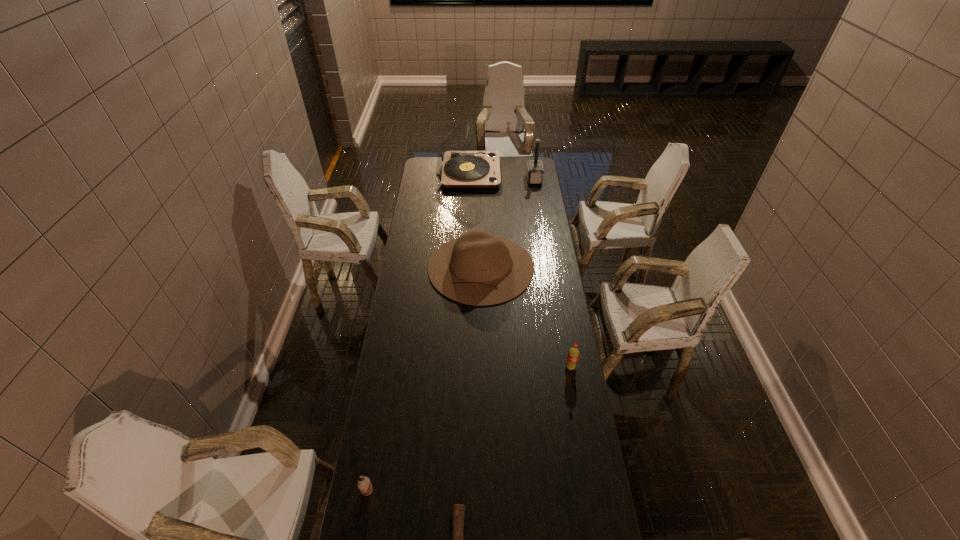
I want to click on vacant area situated 0.120m for striking with the head of the taller hammer, so click(x=507, y=179).

Where is `vacant space located 0.210m for striking with the head of the taller hammer`? Image resolution: width=960 pixels, height=540 pixels. vacant space located 0.210m for striking with the head of the taller hammer is located at coordinates (492, 179).

Image resolution: width=960 pixels, height=540 pixels. What are the coordinates of `free spot located 0.120m for striking with the head of the taller hammer` in the screenshot? It's located at (507, 179).

The width and height of the screenshot is (960, 540). What are the coordinates of `free region located 0.320m on the front of the third tallest object` in the screenshot? It's located at (481, 368).

Where is `vacant point located 0.220m on the back of the fourth farthest object`? The image size is (960, 540). vacant point located 0.220m on the back of the fourth farthest object is located at coordinates (563, 320).

Locate an element on the screen. The image size is (960, 540). free space located on the back of the chocolate milk is located at coordinates (372, 466).

Locate an element on the screen. This screenshot has width=960, height=540. record player that is at the far edge is located at coordinates (456, 168).

I want to click on hammer at the far edge, so click(x=534, y=170).

Locate an element on the screen. The height and width of the screenshot is (540, 960). record player at the left edge is located at coordinates (456, 168).

The image size is (960, 540). I want to click on sombrero situated at the left edge, so click(478, 268).